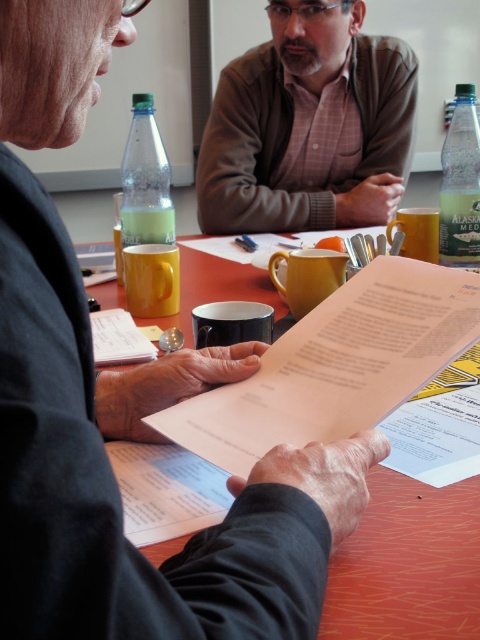
Question: Does translucent green plastic bottle at upper center appear over translucent plastic bottle at upper right?

Choices:
 (A) no
 (B) yes

Answer: (B)

Question: Observing the image, what is the correct spatial positioning of clear plastic bottle at upper right in reference to yellow matte mug at upper center?

Choices:
 (A) right
 (B) left

Answer: (A)

Question: Which object is closer to the camera taking this photo?

Choices:
 (A) translucent plastic bottle at upper right
 (B) wooden table at center
 (C) brown textured shirt at upper center

Answer: (B)

Question: Does translucent green plastic bottle at upper center have a larger size compared to yellow matte mug at upper center?

Choices:
 (A) no
 (B) yes

Answer: (B)

Question: Which of these objects is positioned farthest from the translucent plastic bottle at upper right?

Choices:
 (A) yellow matte mug at upper center
 (B) brown textured shirt at upper center
 (C) translucent green plastic bottle at upper center
 (D) wooden table at center

Answer: (B)

Question: Which of the following is the closest to the observer?

Choices:
 (A) (399, 499)
 (B) (133, 300)
 (C) (463, 234)

Answer: (A)